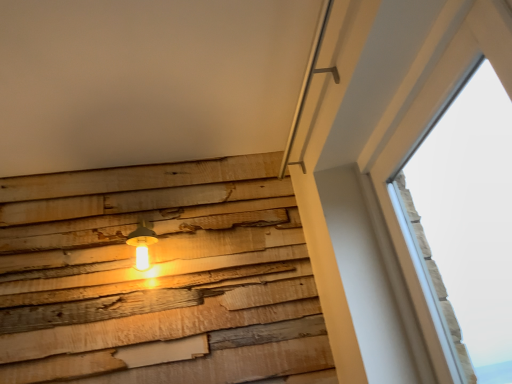
What do you see at coordinates (464, 223) in the screenshot? I see `transparent glass window at upper right` at bounding box center [464, 223].

This screenshot has height=384, width=512. I want to click on transparent glass window at upper right, so click(464, 223).

Find the location of a particular element. matte yellow glass lamp at center-left is located at coordinates (142, 244).

What do you see at coordinates (142, 244) in the screenshot? I see `matte yellow glass lamp at center-left` at bounding box center [142, 244].

The width and height of the screenshot is (512, 384). Identify the location of transparent glass window at upper right. (464, 223).

Is transparent glass window at upper right to the left of matte yellow glass lamp at center-left from the viewer's perspective?

In fact, transparent glass window at upper right is to the right of matte yellow glass lamp at center-left.

Which object is further away from the camera taking this photo, transparent glass window at upper right or matte yellow glass lamp at center-left?

Answer: matte yellow glass lamp at center-left is more distant.

Is point (489, 207) farther from viewer compared to point (146, 227)?

Yes, it is behind point (146, 227).

From the image's perspective, who appears lower, transparent glass window at upper right or matte yellow glass lamp at center-left?

matte yellow glass lamp at center-left, from the image's perspective.

From a real-world perspective, which object stands above the other?

From a 3D spatial view, matte yellow glass lamp at center-left is above.

Can you confirm if transparent glass window at upper right is wider than matte yellow glass lamp at center-left?

No.

Can you confirm if transparent glass window at upper right is taller than matte yellow glass lamp at center-left?

Yes, transparent glass window at upper right is taller than matte yellow glass lamp at center-left.

Considering the sizes of transparent glass window at upper right and matte yellow glass lamp at center-left in the image, is transparent glass window at upper right bigger or smaller than matte yellow glass lamp at center-left?

transparent glass window at upper right is bigger than matte yellow glass lamp at center-left.

Is transparent glass window at upper right surrounding matte yellow glass lamp at center-left?

No, matte yellow glass lamp at center-left is not inside transparent glass window at upper right.

Is transparent glass window at upper right in contact with matte yellow glass lamp at center-left?

No, transparent glass window at upper right is not making contact with matte yellow glass lamp at center-left.

Is transparent glass window at upper right oriented towards matte yellow glass lamp at center-left?

Yes, transparent glass window at upper right is facing matte yellow glass lamp at center-left.

How different are the orientations of transparent glass window at upper right and matte yellow glass lamp at center-left in degrees?

They differ by 91.4 degrees in their facing directions.

How distant is transparent glass window at upper right from matte yellow glass lamp at center-left?

A distance of 4.61 feet exists between transparent glass window at upper right and matte yellow glass lamp at center-left.

Where is `window below the matte yellow glass lamp at center-left (from a real-world perspective)`? window below the matte yellow glass lamp at center-left (from a real-world perspective) is located at coordinates (464, 223).

Between matte yellow glass lamp at center-left and transparent glass window at upper right, which one appears on the left side from the viewer's perspective?

matte yellow glass lamp at center-left is more to the left.

Considering the positions of objects matte yellow glass lamp at center-left and transparent glass window at upper right in the image provided, who is in front, matte yellow glass lamp at center-left or transparent glass window at upper right?

Positioned in front is transparent glass window at upper right.

Is point (152, 240) closer or farther from the camera than point (496, 151)?

Point (152, 240).

From the image's perspective, is matte yellow glass lamp at center-left above or below transparent glass window at upper right?

Clearly, from the image's perspective, matte yellow glass lamp at center-left is below transparent glass window at upper right.

From a real-world perspective, does matte yellow glass lamp at center-left sit lower than transparent glass window at upper right?

No, from a real-world perspective, matte yellow glass lamp at center-left is not beneath transparent glass window at upper right.

Considering the relative sizes of matte yellow glass lamp at center-left and transparent glass window at upper right in the image provided, is matte yellow glass lamp at center-left wider than transparent glass window at upper right?

Correct, the width of matte yellow glass lamp at center-left exceeds that of transparent glass window at upper right.

Which of these two, matte yellow glass lamp at center-left or transparent glass window at upper right, stands taller?

transparent glass window at upper right.

Who is smaller, matte yellow glass lamp at center-left or transparent glass window at upper right?

With smaller size is matte yellow glass lamp at center-left.

Does matte yellow glass lamp at center-left contain transparent glass window at upper right?

No, transparent glass window at upper right is not a part of matte yellow glass lamp at center-left.

Is matte yellow glass lamp at center-left not close to transparent glass window at upper right?

Yes, matte yellow glass lamp at center-left is far from transparent glass window at upper right.

Is matte yellow glass lamp at center-left positioned with its back to transparent glass window at upper right?

matte yellow glass lamp at center-left is not turned away from transparent glass window at upper right.

Measure the distance from matte yellow glass lamp at center-left to transparent glass window at upper right.

matte yellow glass lamp at center-left is 4.61 feet from transparent glass window at upper right.

I want to click on window above the matte yellow glass lamp at center-left (from the image's perspective), so click(x=464, y=223).

Identify the location of window located in front of the matte yellow glass lamp at center-left. Image resolution: width=512 pixels, height=384 pixels. (464, 223).

Where is `lamp behind the transparent glass window at upper right`? The image size is (512, 384). lamp behind the transparent glass window at upper right is located at coordinates 142,244.